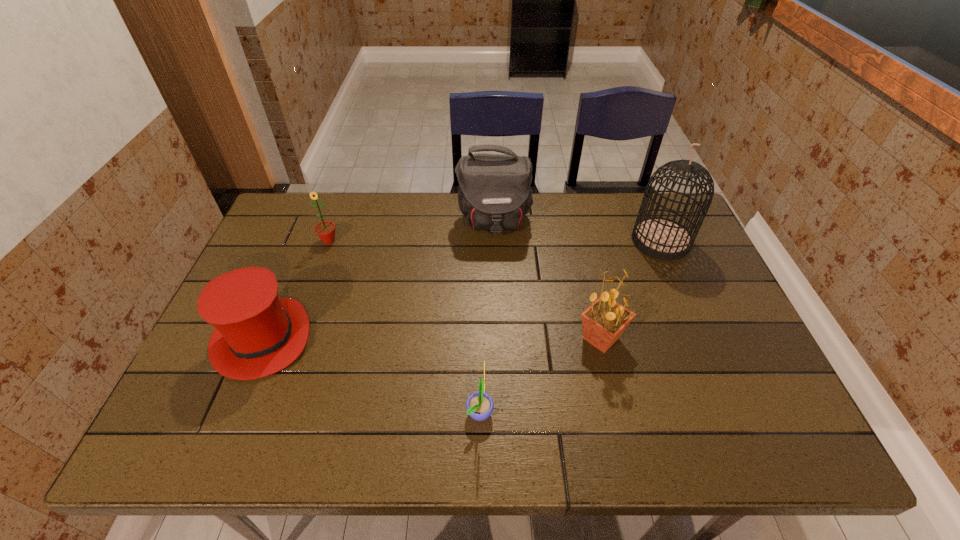
The height and width of the screenshot is (540, 960). In order to click on blank space located 0.240m on the open flap of the shoulder bag in this screenshot , I will do `click(496, 303)`.

This screenshot has width=960, height=540. Find the location of `free point located 0.330m at the front of the second nearest sunflower with flowers visible`. free point located 0.330m at the front of the second nearest sunflower with flowers visible is located at coordinates (444, 339).

At what (x,y) coordinates should I click in order to perform the action: click on vacant space located 0.140m at the front of the second nearest sunflower with flowers visible. Please return your answer as a coordinate pair (x, y). Looking at the image, I should click on (519, 339).

Where is `vacant space located 0.190m at the front of the second nearest sunflower with flowers visible`? This screenshot has height=540, width=960. vacant space located 0.190m at the front of the second nearest sunflower with flowers visible is located at coordinates (499, 339).

Identify the location of vacant area located on the face of the leftmost sunflower. (313, 286).

At what (x,y) coordinates should I click in order to perform the action: click on vacant area situated on the front-facing side of the nearest object. Please return your answer as a coordinate pair (x, y). Looking at the image, I should click on (520, 411).

I want to click on vacant area situated 0.140m on the front of the hat, so [220, 441].

Identify the location of birdcage positioned at the far edge. (661, 238).

The width and height of the screenshot is (960, 540). I want to click on shoulder bag that is at the far edge, so click(494, 193).

Find the location of `sunflower at the far edge`. sunflower at the far edge is located at coordinates (325, 230).